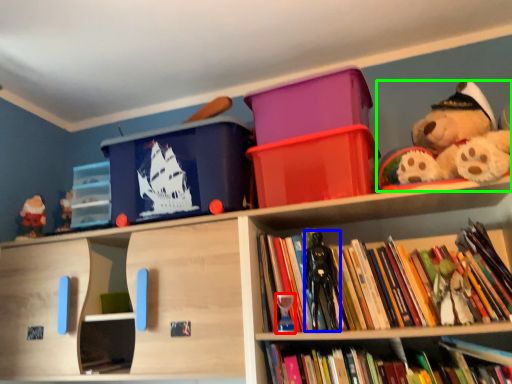
Question: Considering the real-world distances, which object is closest to toy (highlighted by a red box)? toy (highlighted by a blue box) or teddy bear (highlighted by a green box).

Choices:
 (A) toy
 (B) teddy bear

Answer: (A)